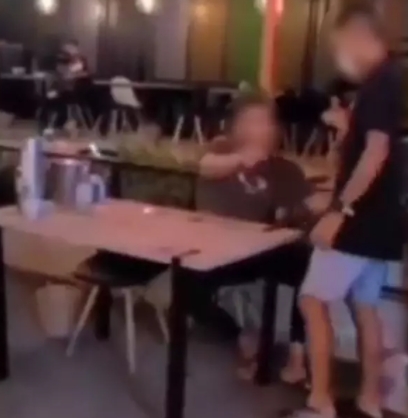
Locate an element on the screen. table legs is located at coordinates (177, 354), (267, 323), (102, 308), (4, 344).